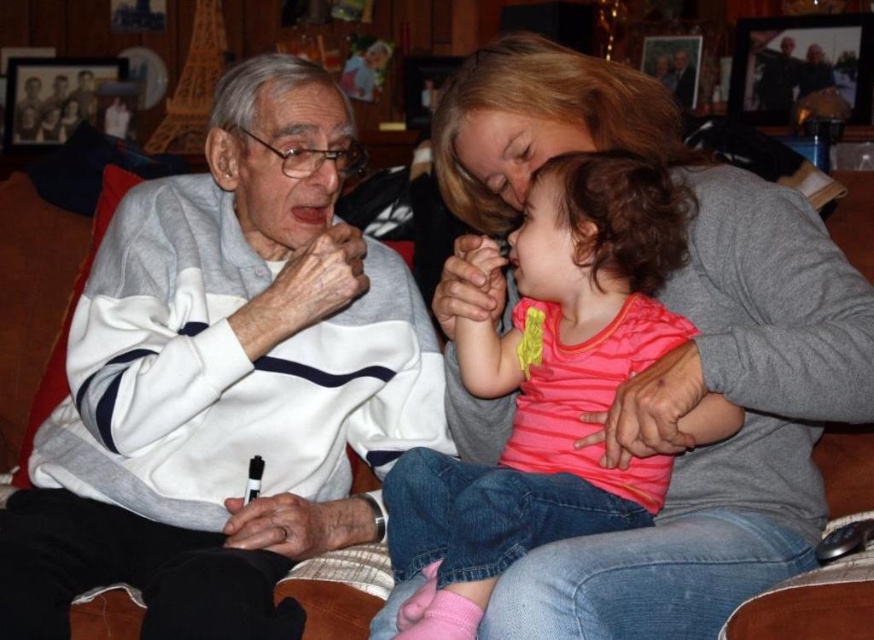
You are a photographer trying to capture a candid shot of the white matte sweater at left and the pink striped shirt at center. Since you want both subjects to be in the frame, which direction should you position your camera relative to the subjects?

To capture both the white matte sweater at left and the pink striped shirt at center in the frame, position the camera to the left of the subjects since the white matte sweater at left is on the left side of the pink striped shirt at center.

You are a delivery person standing at the entrance of the living room. You need to deliver a package to the person wearing the white matte sweater at left. The delivery robot you are using has a maximum reach of 1.2 meters. Can the robot deliver the package directly to the person without moving closer?

The white matte sweater at left is 1.26 meters away from the viewer. Since the robot can only reach up to 1.2 meters, it cannot deliver the package directly without moving closer.

You are a photographer trying to capture a candid shot of the white matte sweater at left and the pink striped shirt at center. Based on their positions, which one is higher in the frame?

The white matte sweater at left is above the pink striped shirt at center in the frame.